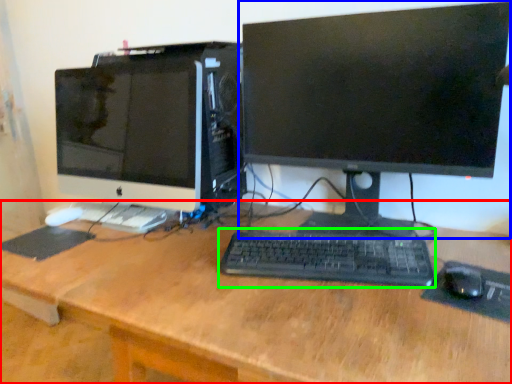
Question: Which object is the closest to the desk (highlighted by a red box)? Choose among these: computer monitor (highlighted by a blue box) or computer keyboard (highlighted by a green box).

Choices:
 (A) computer monitor
 (B) computer keyboard

Answer: (B)